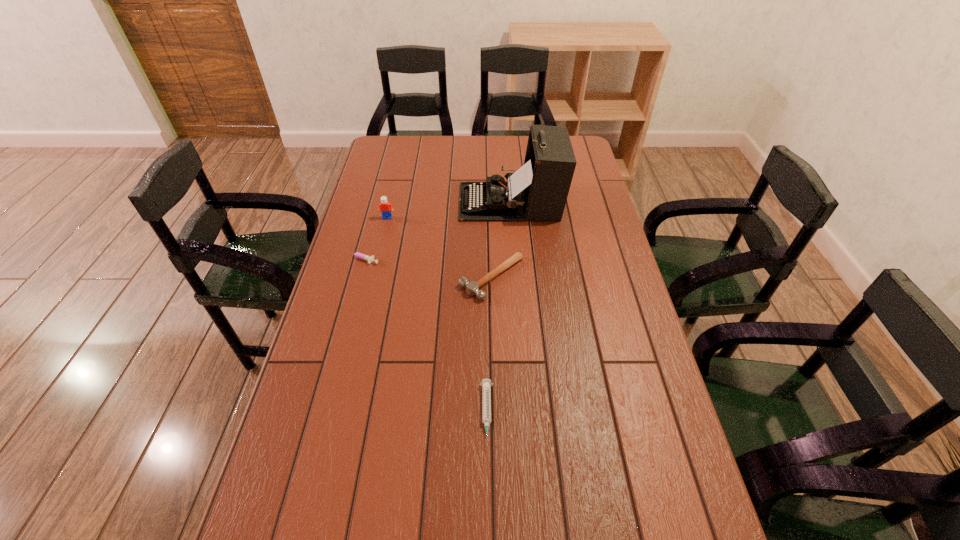
Where is `free region located on the left of the third shortest object`? This screenshot has height=540, width=960. free region located on the left of the third shortest object is located at coordinates (386, 278).

You are a GUI agent. You are given a task and a screenshot of the screen. Output one action in this format:
    pyautogui.click(x=<x>, y=<y>)
    Task: Click on the vacant space located 0.120m at the needle end of the nearer syringe
    Image resolution: width=960 pixels, height=540 pixels.
    Given the screenshot: What is the action you would take?
    pyautogui.click(x=488, y=504)

Identify the location of free space located on the front of the left syringe. (351, 293).

At what (x,y) coordinates should I click in order to perform the action: click on Lego positioned at the left edge. Please return your answer as a coordinate pair (x, y). The width and height of the screenshot is (960, 540). Looking at the image, I should click on (385, 207).

Where is `syringe present at the left edge`? The image size is (960, 540). syringe present at the left edge is located at coordinates (358, 255).

Identify the location of object that is at the right edge. This screenshot has width=960, height=540. (538, 190).

The height and width of the screenshot is (540, 960). In order to click on vacant area at the far edge of the desktop in this screenshot , I will do `click(442, 154)`.

I want to click on vacant space at the left edge of the desktop, so click(x=310, y=449).

Locate an element on the screen. free spot at the right edge of the desktop is located at coordinates (574, 182).

Image resolution: width=960 pixels, height=540 pixels. Find the location of `vacant space at the far left corner of the desktop`. vacant space at the far left corner of the desktop is located at coordinates (397, 156).